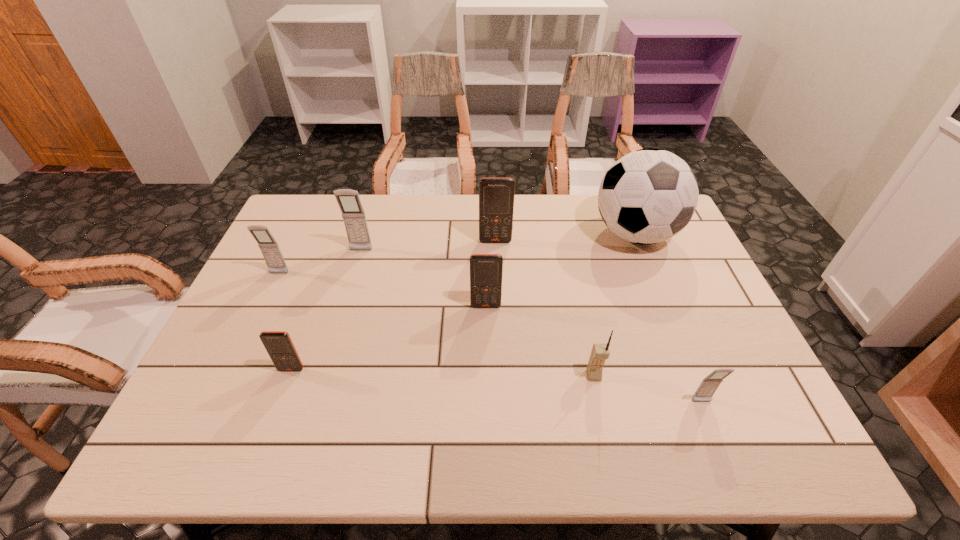
In order to click on the tallest object in this screenshot , I will do `click(649, 195)`.

Identify the location of black soccer ball. The image size is (960, 540). (649, 195).

Find the location of `the biggest gray cellular telephone`. the biggest gray cellular telephone is located at coordinates (353, 214).

The image size is (960, 540). I want to click on the sixth object from right to left, so click(x=353, y=214).

Identify the location of the farthest cellular telephone. (496, 195).

At what (x,y) coordinates should I click in order to perform the action: click on the farthest orange cellular telephone. Please return your answer as a coordinate pair (x, y). The height and width of the screenshot is (540, 960). Looking at the image, I should click on (496, 195).

Find the location of a particular element. the second smallest gray cellular telephone is located at coordinates (271, 252).

Find the location of a particular element. The height and width of the screenshot is (540, 960). the leftmost gray cellular telephone is located at coordinates (271, 252).

The image size is (960, 540). Find the location of `the fourth nearest object`. the fourth nearest object is located at coordinates (486, 270).

The width and height of the screenshot is (960, 540). Identify the location of the fourth farthest cellular telephone. (486, 270).